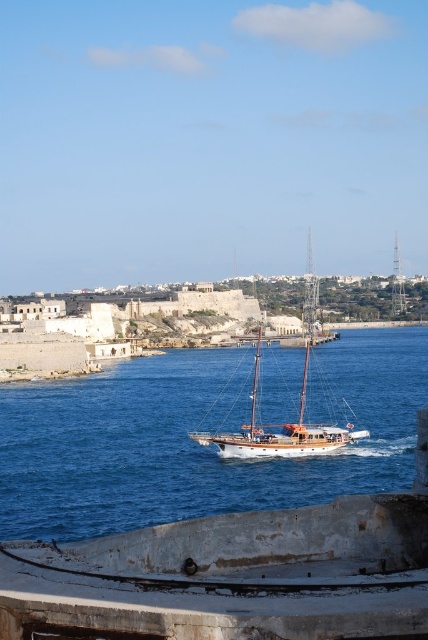
Question: Which of the following is the farthest from the observer?

Choices:
 (A) (38, 536)
 (B) (261, 451)

Answer: (B)

Question: Which object is farther from the camera taking this photo?

Choices:
 (A) wooden sailboat at center
 (B) blue water at center

Answer: (A)

Question: Can you confirm if blue water at center is bigger than wooden sailboat at center?

Choices:
 (A) yes
 (B) no

Answer: (A)

Question: Can you confirm if blue water at center is bigger than wooden sailboat at center?

Choices:
 (A) yes
 (B) no

Answer: (A)

Question: Is blue water at center to the right of wooden sailboat at center from the viewer's perspective?

Choices:
 (A) no
 (B) yes

Answer: (B)